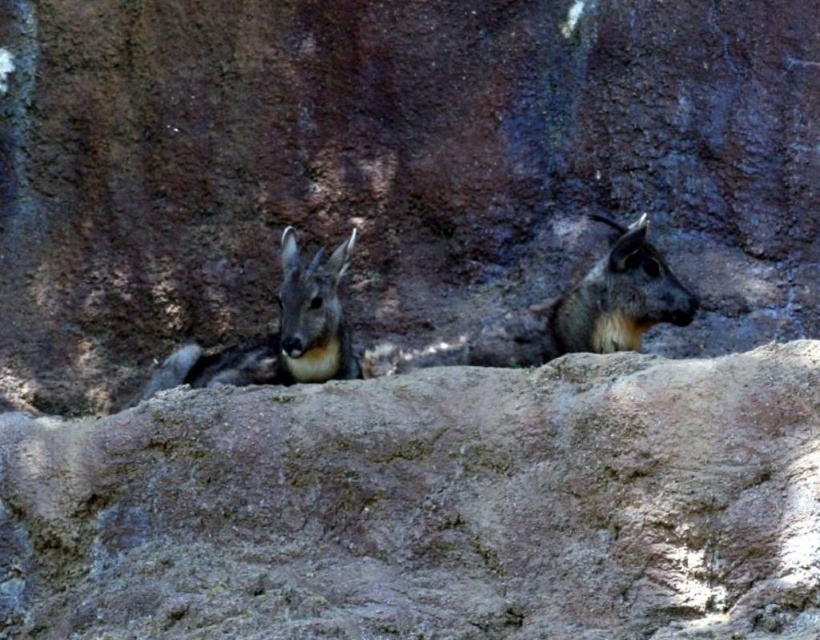
Can you confirm if brown rough rock at center is wider than brown fur goat at center?

Yes.

Does brown rough rock at center appear under brown fur goat at center?

Correct, brown rough rock at center is located below brown fur goat at center.

Is point (240, 403) closer to viewer compared to point (247, 381)?

Yes, point (240, 403) is in front of point (247, 381).

The image size is (820, 640). What are the coordinates of `brown rough rock at center` in the screenshot? It's located at (427, 506).

Which of these two, brown rough rock at center or gray fur goat at center, stands shorter?

gray fur goat at center is shorter.

Is point (449, 522) farther from viewer compared to point (632, 301)?

No, (449, 522) is in front of (632, 301).

The height and width of the screenshot is (640, 820). Identify the location of brown rough rock at center. (427, 506).

Does brown fur goat at center appear on the left side of gray fur goat at center?

Correct, you'll find brown fur goat at center to the left of gray fur goat at center.

Does brown fur goat at center appear over gray fur goat at center?

No, brown fur goat at center is not above gray fur goat at center.

Does point (199, 368) come closer to viewer compared to point (557, 304)?

No, (199, 368) is behind (557, 304).

Locate an element on the screen. brown fur goat at center is located at coordinates (294, 328).